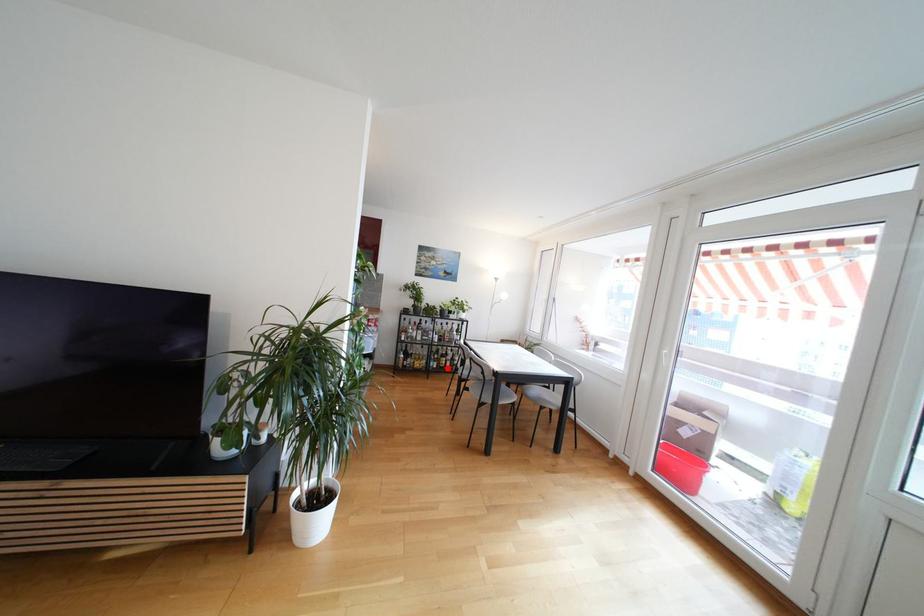
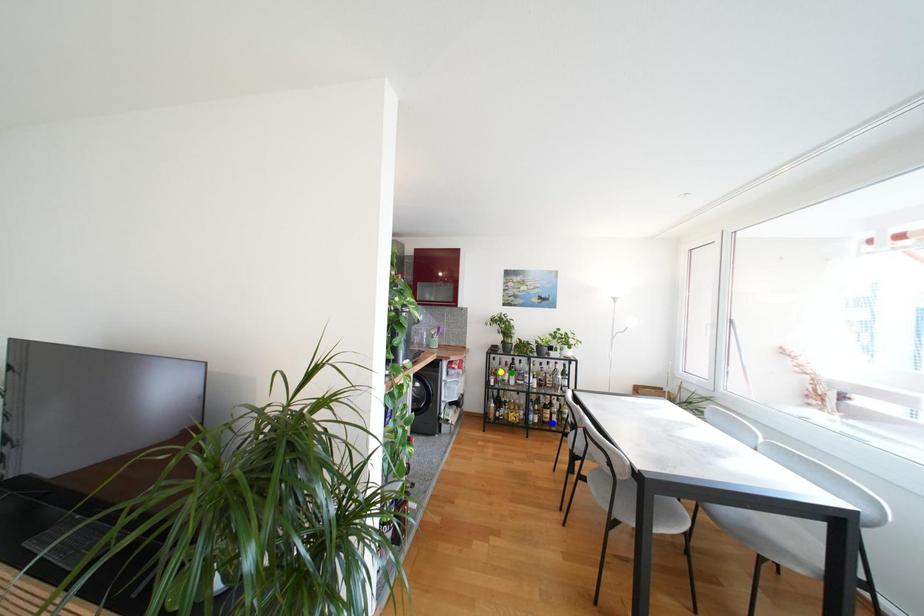
Question: I am providing you with two images of the same scene from different viewpoints. A red point is marked on the first image. You are given multiple points on the second image. Which mark in image 2 goes with the point in image 1?

Choices:
 (A) yellow point
 (B) blue point
 (C) green point

Answer: (B)